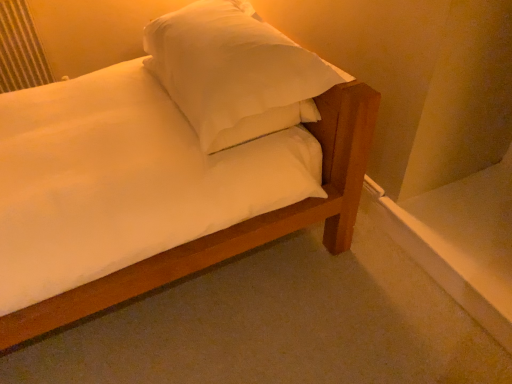
Question: Is white matte bed at center positioned beyond the bounds of white soft pillow at upper center?

Choices:
 (A) no
 (B) yes

Answer: (A)

Question: From a real-world perspective, does white matte bed at center sit lower than white soft pillow at upper center?

Choices:
 (A) no
 (B) yes

Answer: (B)

Question: Is white matte bed at center positioned before white soft pillow at upper center?

Choices:
 (A) yes
 (B) no

Answer: (B)

Question: Considering the relative sizes of white matte bed at center and white soft pillow at upper center in the image provided, is white matte bed at center thinner than white soft pillow at upper center?

Choices:
 (A) no
 (B) yes

Answer: (A)

Question: Is white matte bed at center wider than white soft pillow at upper center?

Choices:
 (A) no
 (B) yes

Answer: (B)

Question: Is white matte bed at center placed right next to white soft pillow at upper center?

Choices:
 (A) no
 (B) yes

Answer: (A)

Question: Is white matte bed at center closer to camera compared to metallic silver radiator at upper left?

Choices:
 (A) yes
 (B) no

Answer: (A)

Question: Is white matte bed at center at the left side of metallic silver radiator at upper left?

Choices:
 (A) no
 (B) yes

Answer: (A)

Question: Is white matte bed at center shorter than metallic silver radiator at upper left?

Choices:
 (A) yes
 (B) no

Answer: (A)

Question: Is white matte bed at center in contact with metallic silver radiator at upper left?

Choices:
 (A) yes
 (B) no

Answer: (B)

Question: Does white matte bed at center have a greater width compared to metallic silver radiator at upper left?

Choices:
 (A) no
 (B) yes

Answer: (B)

Question: Is the position of white matte bed at center more distant than that of metallic silver radiator at upper left?

Choices:
 (A) no
 (B) yes

Answer: (A)

Question: From the image's perspective, is white soft pillow at upper center beneath white matte bed at center?

Choices:
 (A) yes
 (B) no

Answer: (B)